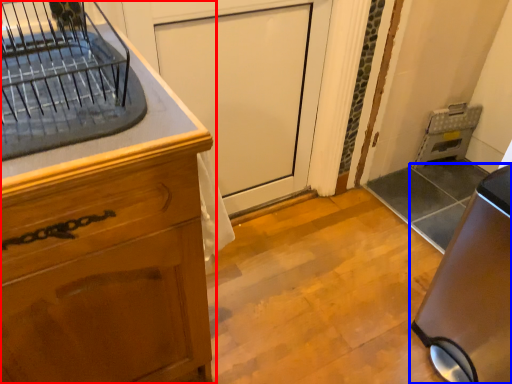
Question: Which of the following is the closest to the observer, cabinetry (highlighted by a red box) or home appliance (highlighted by a blue box)?

Choices:
 (A) cabinetry
 (B) home appliance

Answer: (A)